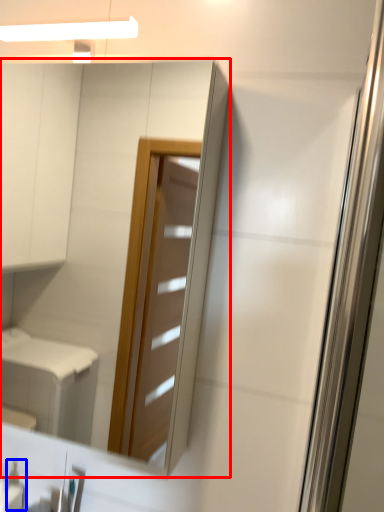
Question: Which point is closer to the camera, mirror (highlighted by a red box) or toiletry (highlighted by a blue box)?

Choices:
 (A) mirror
 (B) toiletry

Answer: (A)